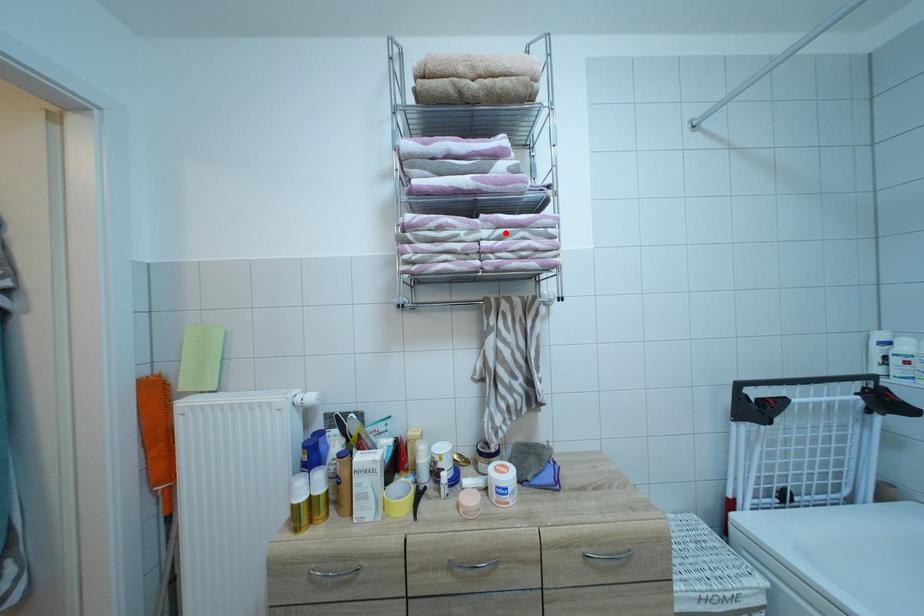
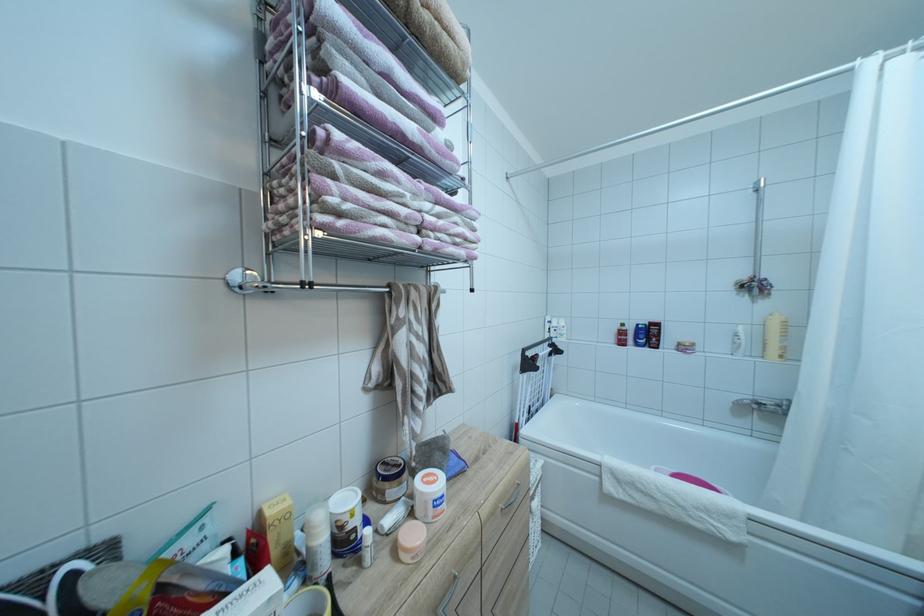
Locate, in the second image, the point that corresponds to the highlighted location in the first image.

(444, 209)